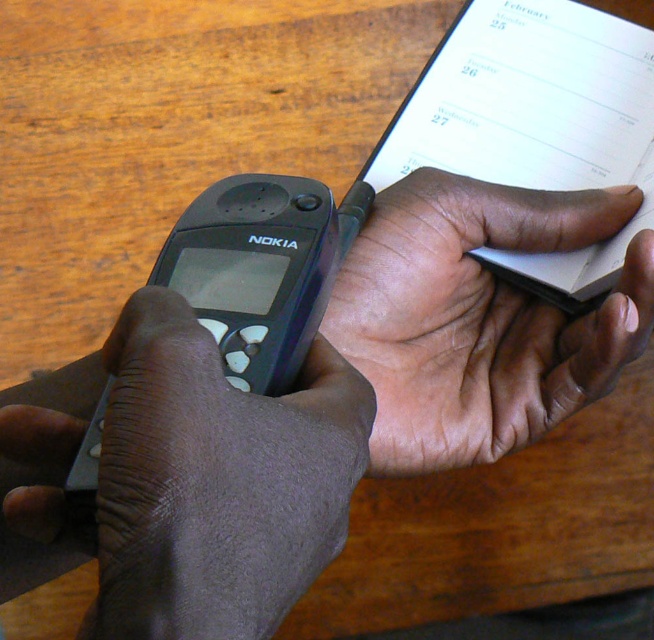
You are a delivery person who needs to place a 3.5 inch wide package between the matte black phone at center and the black matte nokia phone at left. Can you fit the package in the space between them?

The space between the matte black phone at center and the black matte nokia phone at left is only 2.54 inches, which is smaller than the 3.5 inch wide package. The package cannot fit in the space between them.